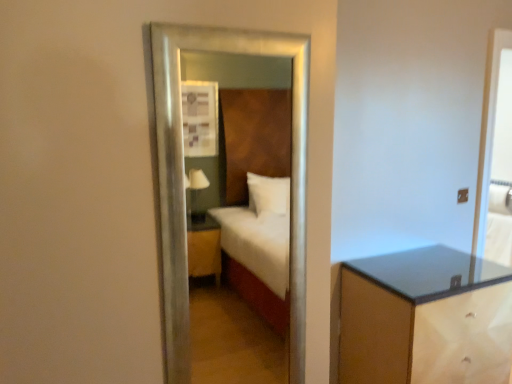
Question: Should I look upward or downward to see clear glass screen door at right?

Choices:
 (A) down
 (B) up

Answer: (B)

Question: Considering the relative sizes of matte brown nightstand at lower right and clear glass screen door at right in the image provided, is matte brown nightstand at lower right smaller than clear glass screen door at right?

Choices:
 (A) yes
 (B) no

Answer: (B)

Question: Considering the relative sizes of matte brown nightstand at lower right and clear glass screen door at right in the image provided, is matte brown nightstand at lower right thinner than clear glass screen door at right?

Choices:
 (A) no
 (B) yes

Answer: (A)

Question: Is matte brown nightstand at lower right positioned in front of clear glass screen door at right?

Choices:
 (A) no
 (B) yes

Answer: (B)

Question: From a real-world perspective, is matte brown nightstand at lower right located higher than clear glass screen door at right?

Choices:
 (A) no
 (B) yes

Answer: (A)

Question: Would you say clear glass screen door at right is part of matte brown nightstand at lower right's contents?

Choices:
 (A) yes
 (B) no

Answer: (B)

Question: Does matte brown nightstand at lower right come behind clear glass screen door at right?

Choices:
 (A) yes
 (B) no

Answer: (B)

Question: From the image's perspective, is matte brown nightstand at lower right located beneath silver metallic mirror at center?

Choices:
 (A) yes
 (B) no

Answer: (A)

Question: Would you say matte brown nightstand at lower right contains silver metallic mirror at center?

Choices:
 (A) no
 (B) yes

Answer: (A)

Question: Can you confirm if matte brown nightstand at lower right is bigger than silver metallic mirror at center?

Choices:
 (A) no
 (B) yes

Answer: (B)

Question: Does matte brown nightstand at lower right have a greater height compared to silver metallic mirror at center?

Choices:
 (A) no
 (B) yes

Answer: (A)

Question: Does matte brown nightstand at lower right come in front of silver metallic mirror at center?

Choices:
 (A) no
 (B) yes

Answer: (A)

Question: Is matte brown nightstand at lower right positioned far away from silver metallic mirror at center?

Choices:
 (A) no
 (B) yes

Answer: (A)

Question: Considering the relative positions of clear glass screen door at right and matte brown nightstand at lower right in the image provided, is clear glass screen door at right behind matte brown nightstand at lower right?

Choices:
 (A) yes
 (B) no

Answer: (A)